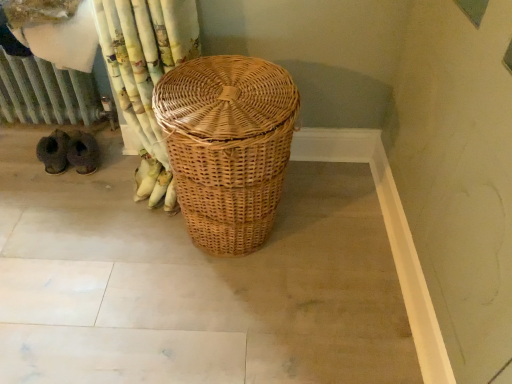
Image resolution: width=512 pixels, height=384 pixels. Find the location of `vacant region to the left of natural wicker basket at center`. vacant region to the left of natural wicker basket at center is located at coordinates (110, 240).